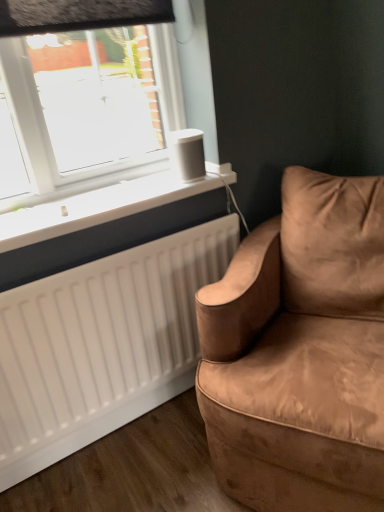
At what (x,y) coordinates should I click in order to perform the action: click on vacant space to the left of white matte speaker at upper center. Please return your answer as a coordinate pair (x, y). The width and height of the screenshot is (384, 512). Looking at the image, I should click on (142, 185).